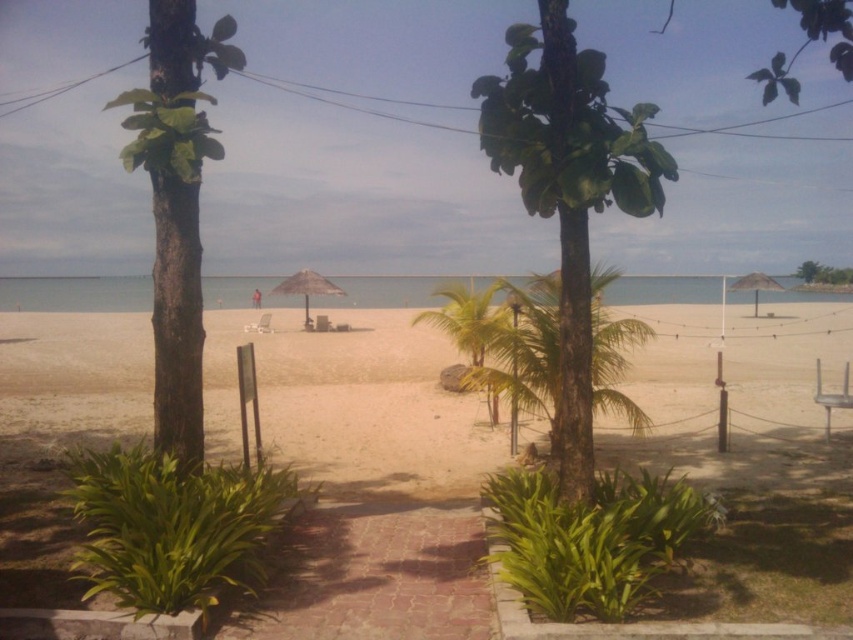
Question: Is light beige sand at center bigger than green leafy palm tree at center?

Choices:
 (A) no
 (B) yes

Answer: (B)

Question: Is green leafy tree at upper right above beige fabric umbrella at right?

Choices:
 (A) yes
 (B) no

Answer: (A)

Question: Is green leafy palm tree at center below green leafy tree at upper right?

Choices:
 (A) yes
 (B) no

Answer: (A)

Question: Based on their relative distances, which object is farther from the beige fabric umbrella at right?

Choices:
 (A) green leafy tree at upper right
 (B) green rough bark tree at left
 (C) green leafy tree at center

Answer: (B)

Question: Among these points, which one is nearest to the camera?

Choices:
 (A) (851, 282)
 (B) (740, 476)

Answer: (B)

Question: Which object is closer to the camera taking this photo?

Choices:
 (A) beige woven umbrella at center
 (B) light beige sand at center
 (C) green rough bark tree at left
 (D) green leafy tree at upper right

Answer: (C)